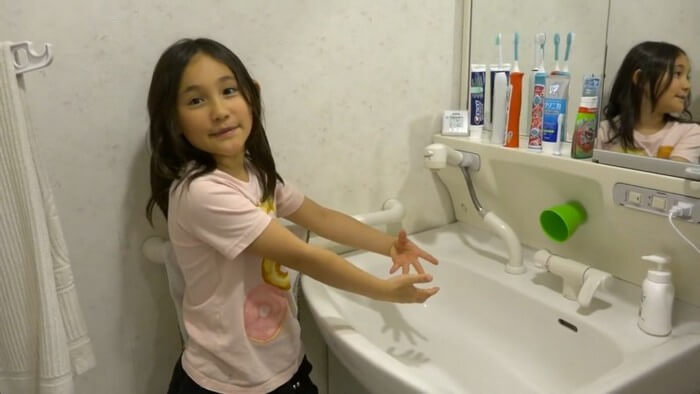
The width and height of the screenshot is (700, 394). I want to click on green cup, so click(556, 212).